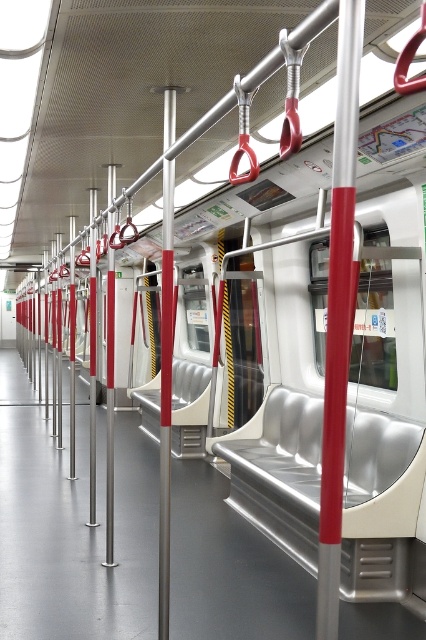
Between metallic red pole at center and metallic silver pole at center, which one is positioned lower?

metallic silver pole at center is lower down.

Can you confirm if metallic red pole at center is taller than metallic silver pole at center?

No, metallic red pole at center is not taller than metallic silver pole at center.

Who is more forward, [336,58] or [169,358]?

Point [336,58] is in front.

The height and width of the screenshot is (640, 426). I want to click on metallic red pole at center, so click(339, 314).